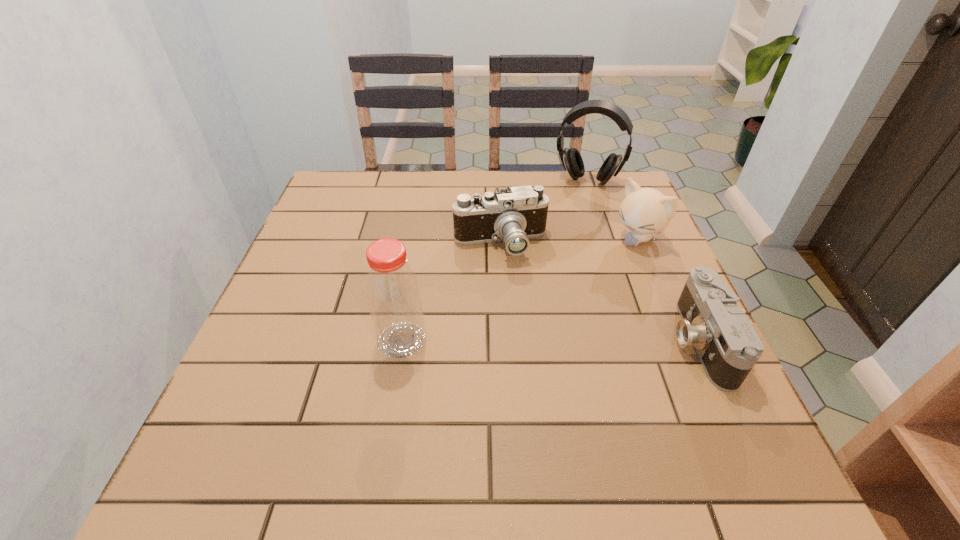
The image size is (960, 540). In order to click on vacant spot on the desktop that is between the leftmost object and the nearer camera and is positioned on the face of the kitten in this screenshot , I will do `click(509, 341)`.

Identify the location of vacant spot on the desktop that is between the leftmost object and the shortest object and is positioned on the ear cups of the earphone. (541, 341).

The height and width of the screenshot is (540, 960). Find the location of `vacant space on the desktop that is between the bottle and the shortest object and is positioned at the lens of the farther camera`. vacant space on the desktop that is between the bottle and the shortest object and is positioned at the lens of the farther camera is located at coordinates (510, 341).